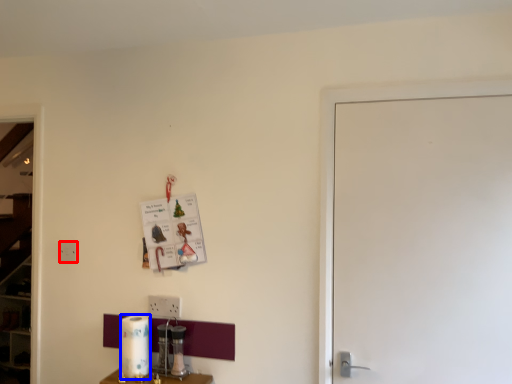
Question: Among these objects, which one is farthest to the camera, electric outlet (highlighted by a red box) or paper towel (highlighted by a blue box)?

Choices:
 (A) electric outlet
 (B) paper towel

Answer: (A)